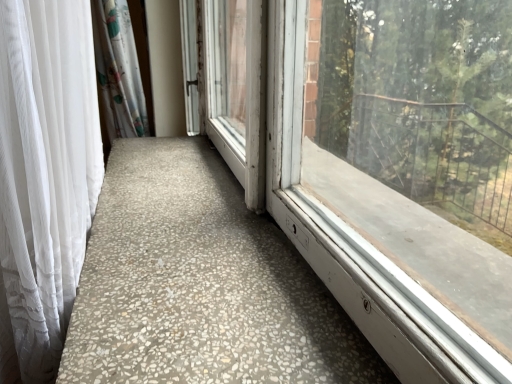
Question: Would you say white sheer curtain at left is part of speckled concrete floor at center's contents?

Choices:
 (A) no
 (B) yes

Answer: (A)

Question: Is speckled concrete floor at center directly adjacent to white sheer curtain at left?

Choices:
 (A) no
 (B) yes

Answer: (A)

Question: Is speckled concrete floor at center thinner than white sheer curtain at left?

Choices:
 (A) yes
 (B) no

Answer: (B)

Question: Is the depth of speckled concrete floor at center greater than that of white sheer curtain at left?

Choices:
 (A) yes
 (B) no

Answer: (A)

Question: Does speckled concrete floor at center come in front of white sheer curtain at left?

Choices:
 (A) yes
 (B) no

Answer: (B)

Question: Considering the relative sizes of speckled concrete floor at center and white sheer curtain at left in the image provided, is speckled concrete floor at center bigger than white sheer curtain at left?

Choices:
 (A) no
 (B) yes

Answer: (A)

Question: Is white sheer curtain at left bigger than speckled concrete floor at center?

Choices:
 (A) yes
 (B) no

Answer: (A)

Question: Could you tell me if white sheer curtain at left is facing speckled concrete floor at center?

Choices:
 (A) yes
 (B) no

Answer: (A)

Question: From the image's perspective, is white sheer curtain at left above speckled concrete floor at center?

Choices:
 (A) no
 (B) yes

Answer: (A)

Question: Does white sheer curtain at left lie in front of speckled concrete floor at center?

Choices:
 (A) yes
 (B) no

Answer: (A)

Question: Is white sheer curtain at left placed right next to speckled concrete floor at center?

Choices:
 (A) yes
 (B) no

Answer: (B)

Question: Could speckled concrete floor at center be considered to be inside white sheer curtain at left?

Choices:
 (A) no
 (B) yes

Answer: (A)

Question: From a real-world perspective, relative to speckled concrete floor at center, is white sheer curtain at left vertically above or below?

Choices:
 (A) below
 (B) above

Answer: (A)